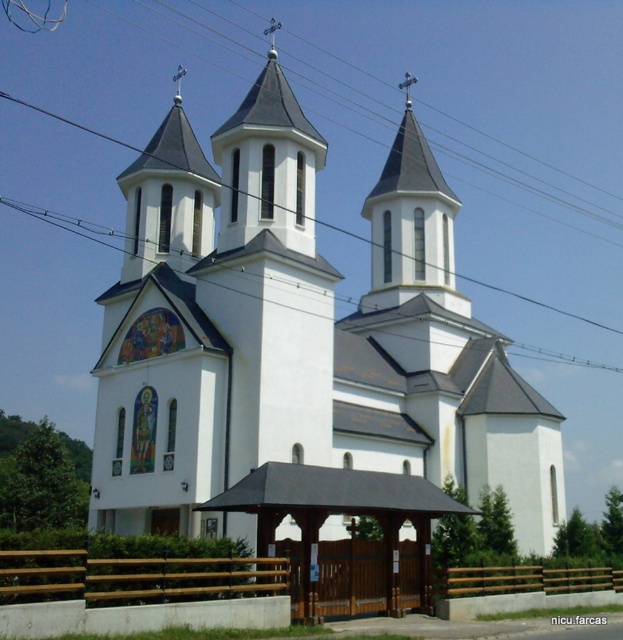
Question: Does white smooth church at center come behind brown wooden gazebo at lower center?

Choices:
 (A) yes
 (B) no

Answer: (A)

Question: Which point appears farthest from the camera in this image?

Choices:
 (A) click(x=207, y=524)
 (B) click(x=397, y=484)
 (C) click(x=6, y=582)

Answer: (A)

Question: Can you confirm if brown wooden gazebo at lower center is wider than brown wooden gate at lower center?

Choices:
 (A) yes
 (B) no

Answer: (B)

Question: Which object appears farthest from the camera in this image?

Choices:
 (A) white smooth church at center
 (B) brown wooden gazebo at lower center

Answer: (A)

Question: Is brown wooden gazebo at lower center wider than brown wooden gate at lower center?

Choices:
 (A) no
 (B) yes

Answer: (A)

Question: Among these objects, which one is farthest from the camera?

Choices:
 (A) brown wooden gate at lower center
 (B) white smooth church at center
 (C) brown wooden gazebo at lower center

Answer: (B)